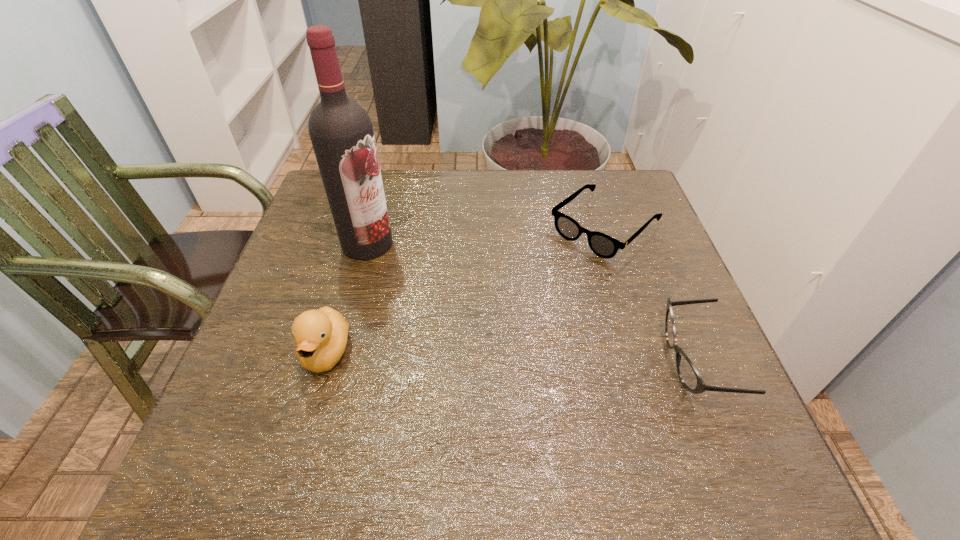
This screenshot has height=540, width=960. I want to click on vacant region that satisfies the following two spatial constraints: 1. facing forward on the nearer spectacles; 2. on the front-facing side of the second tallest object, so click(x=324, y=361).

At what (x,y) coordinates should I click in order to perform the action: click on vacant point that satisfies the following two spatial constraints: 1. on the front side of the nearer spectacles; 2. on the front-facing side of the farther spectacles. Please return your answer as a coordinate pair (x, y). Looking at the image, I should click on (646, 361).

What are the coordinates of `vacant space that satisfies the following two spatial constraints: 1. on the front side of the farther spectacles; 2. on the front-facing side of the nearer spectacles` in the screenshot? It's located at (646, 361).